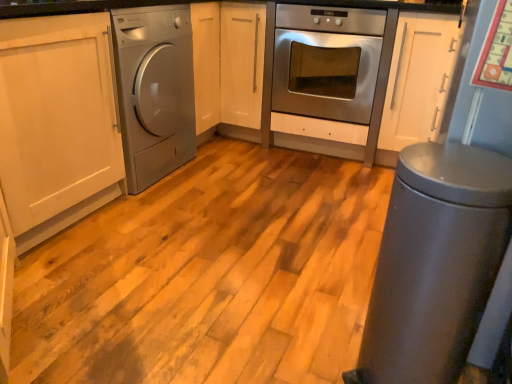
This screenshot has height=384, width=512. Find the location of `empty space that is ontop of metallic gray trash can at lower right (from a real-world perspective)`. empty space that is ontop of metallic gray trash can at lower right (from a real-world perspective) is located at coordinates (441, 168).